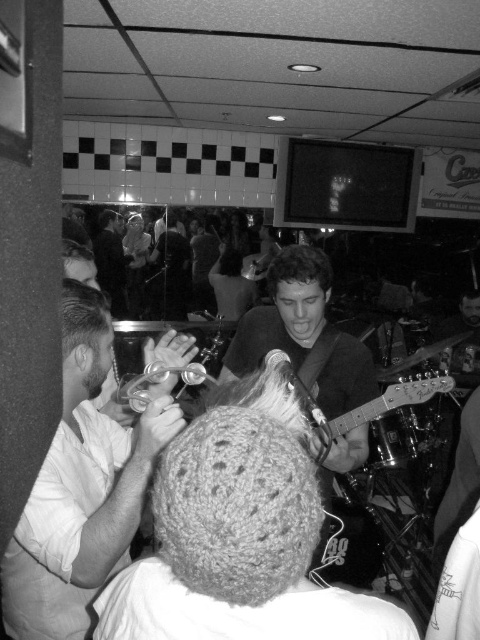
Can you confirm if white cotton shirt at left is thinner than metallic silver guitar at center?

Correct, white cotton shirt at left's width is less than metallic silver guitar at center's.

Is point (21, 600) farther from camera compared to point (313, 428)?

No, (21, 600) is closer to viewer.

Image resolution: width=480 pixels, height=640 pixels. What are the coordinates of `white cotton shirt at left` in the screenshot? It's located at (81, 488).